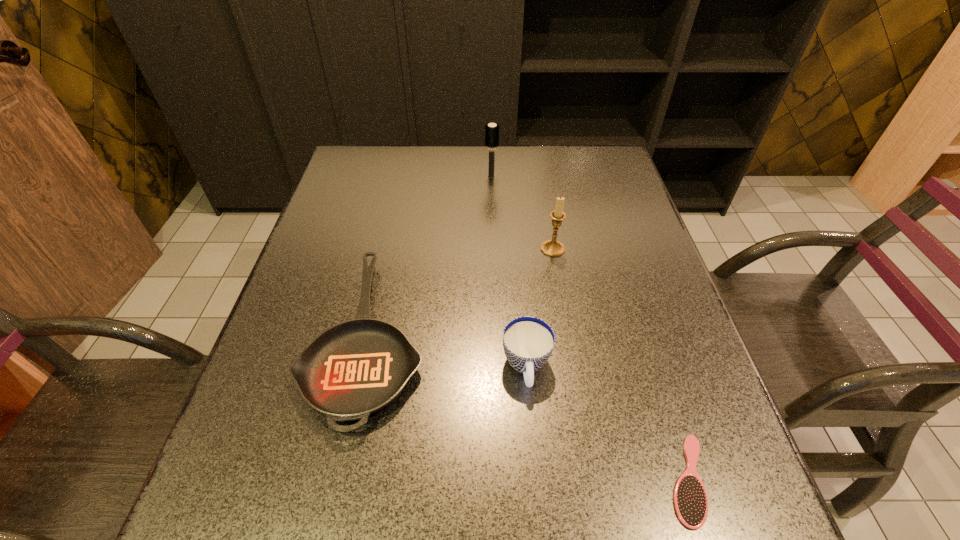
This screenshot has width=960, height=540. Identify the location of free space located on the right of the candle holder. pyautogui.click(x=588, y=249).

At what (x,y) coordinates should I click in order to perform the action: click on blank space located 0.130m on the side of the third tallest object with the handle. Please return your answer as a coordinate pair (x, y). The width and height of the screenshot is (960, 540). Looking at the image, I should click on (535, 467).

Where is `free point located on the back of the frying pan`? free point located on the back of the frying pan is located at coordinates coord(401,181).

Image resolution: width=960 pixels, height=540 pixels. I want to click on vacant position located 0.170m on the back of the nearer hairbrush, so click(x=649, y=355).

The image size is (960, 540). Find the location of `object that is at the far edge`. object that is at the far edge is located at coordinates (491, 130).

Find the location of a particular element. object at the near edge is located at coordinates (690, 497).

What are the coordinates of `object that is at the left edge` in the screenshot? It's located at (355, 368).

Identify the location of object positioned at the right edge. (690, 497).

Locate an element on the screen. The height and width of the screenshot is (540, 960). object present at the near right corner is located at coordinates (690, 497).

This screenshot has height=540, width=960. What are the coordinates of `vacant space at the far edge of the desktop` in the screenshot? It's located at (471, 164).